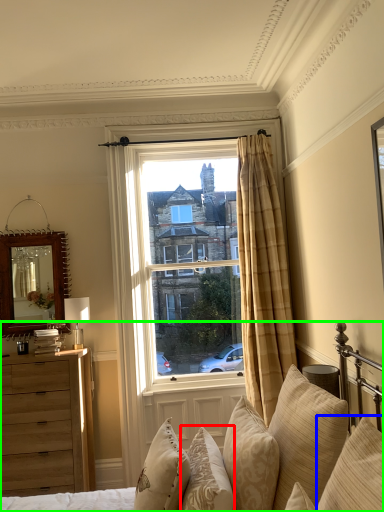
Question: Estimate the real-world distances between objects in this image. Which object is farther from pillow (highlighted by a red box), pillow (highlighted by a blue box) or studio couch (highlighted by a green box)?

Choices:
 (A) pillow
 (B) studio couch

Answer: (A)